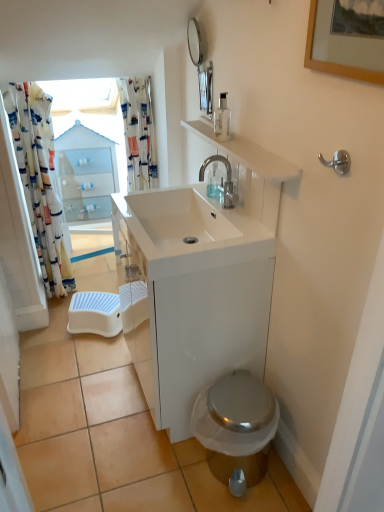
I want to click on free space above white plastic step stool at lower left (from a real-world perspective), so click(97, 302).